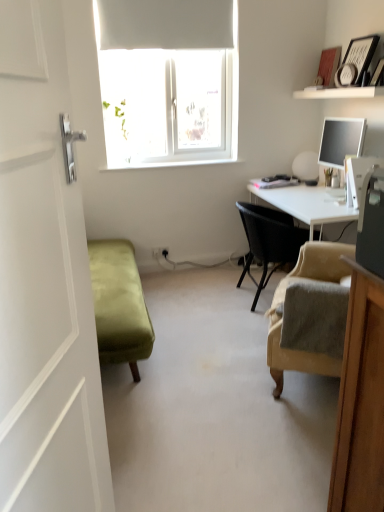
Question: From the image's perspective, is black woven chair at center, arranged as the second chair when viewed from the front, located above or below white matte shelf at upper right?

Choices:
 (A) above
 (B) below

Answer: (B)

Question: Considering the relative positions of black woven chair at center, arranged as the second chair when viewed from the front, and white matte shelf at upper right in the image provided, is black woven chair at center, arranged as the second chair when viewed from the front, to the left or to the right of white matte shelf at upper right?

Choices:
 (A) left
 (B) right

Answer: (A)

Question: Estimate the real-world distances between objects in this image. Which object is closer to the white glossy door handle at left?

Choices:
 (A) white matte table lamp at right
 (B) beige fabric armchair at lower right, the second chair positioned from the back
 (C) black woven chair at center, acting as the first chair starting from the back
 (D) white matte shelf at upper right

Answer: (B)

Question: Estimate the real-world distances between objects in this image. Which object is farther from the black woven chair at center, acting as the first chair starting from the back?

Choices:
 (A) white matte table lamp at right
 (B) beige fabric armchair at lower right, the 1th chair viewed from the front
 (C) white glossy door handle at left
 (D) white matte shelf at upper right

Answer: (C)